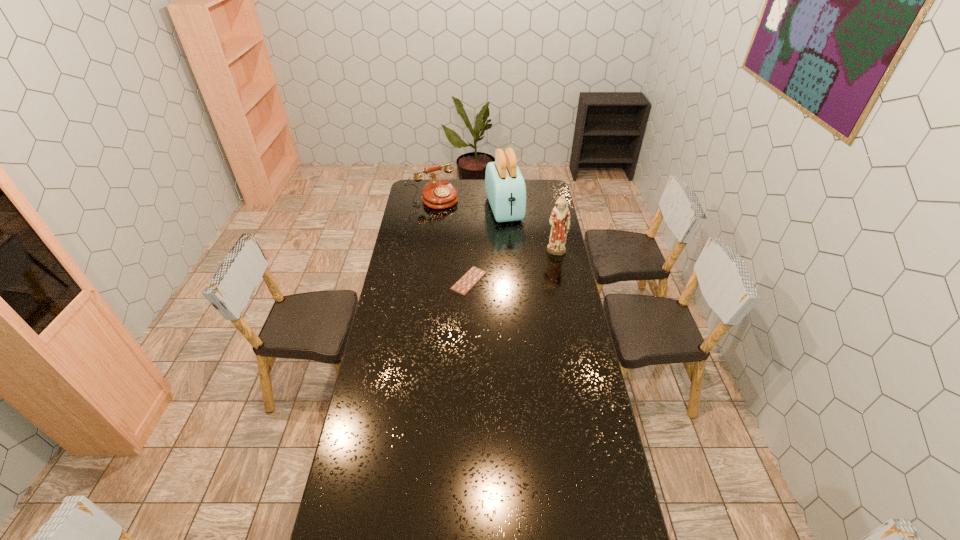
Where is `the shortest object`? This screenshot has width=960, height=540. the shortest object is located at coordinates (466, 282).

The image size is (960, 540). In order to click on chocolate bar in this screenshot , I will do `click(466, 282)`.

Where is `figurine`? The height and width of the screenshot is (540, 960). figurine is located at coordinates (559, 220).

In order to click on the rightmost object in this screenshot , I will do `click(559, 220)`.

Image resolution: width=960 pixels, height=540 pixels. I want to click on toaster, so click(x=505, y=187).

The width and height of the screenshot is (960, 540). Find the location of `telephone`. telephone is located at coordinates (438, 194).

Where is `blank area located 0.220m on the right of the nearest object`? blank area located 0.220m on the right of the nearest object is located at coordinates (533, 281).

At what (x,y) coordinates should I click in order to perform the action: click on blank area located 0.190m on the front-facing side of the rightmost object. Please return your answer as a coordinate pair (x, y). The image size is (960, 540). Looking at the image, I should click on (563, 285).

Find the location of a particular element. The width and height of the screenshot is (960, 540). free space located 0.320m on the side of the toaster with the lever is located at coordinates (523, 262).

Locate an element on the screen. This screenshot has width=960, height=540. free space located 0.280m on the side of the toaster with the lever is located at coordinates (521, 258).